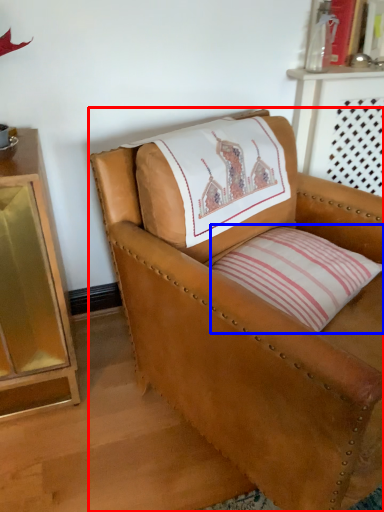
Question: Which of the following is the farthest to the observer, chair (highlighted by a red box) or pillow (highlighted by a blue box)?

Choices:
 (A) chair
 (B) pillow

Answer: (B)